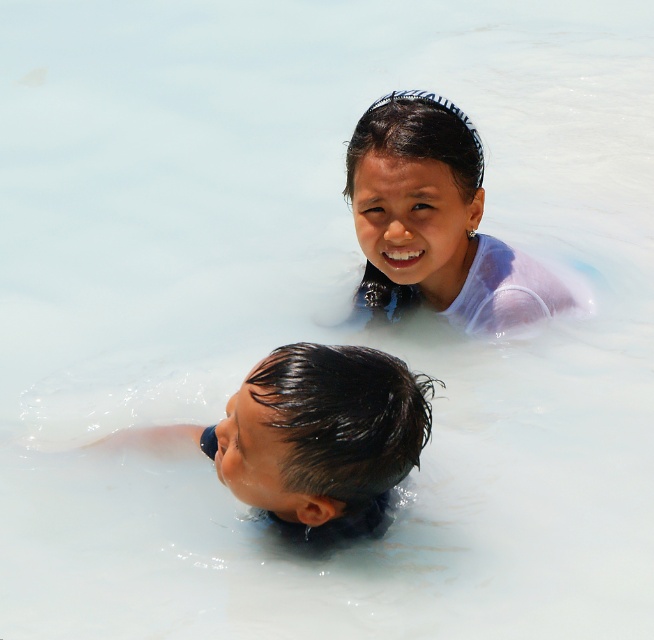
Can you confirm if wet black hair at lower center is bigger than white matte hair at upper center?

Correct, wet black hair at lower center is larger in size than white matte hair at upper center.

Between wet black hair at lower center and white matte hair at upper center, which one appears on the right side from the viewer's perspective?

white matte hair at upper center is more to the right.

Locate an element on the screen. This screenshot has height=640, width=654. wet black hair at lower center is located at coordinates (313, 438).

I want to click on wet black hair at lower center, so click(x=313, y=438).